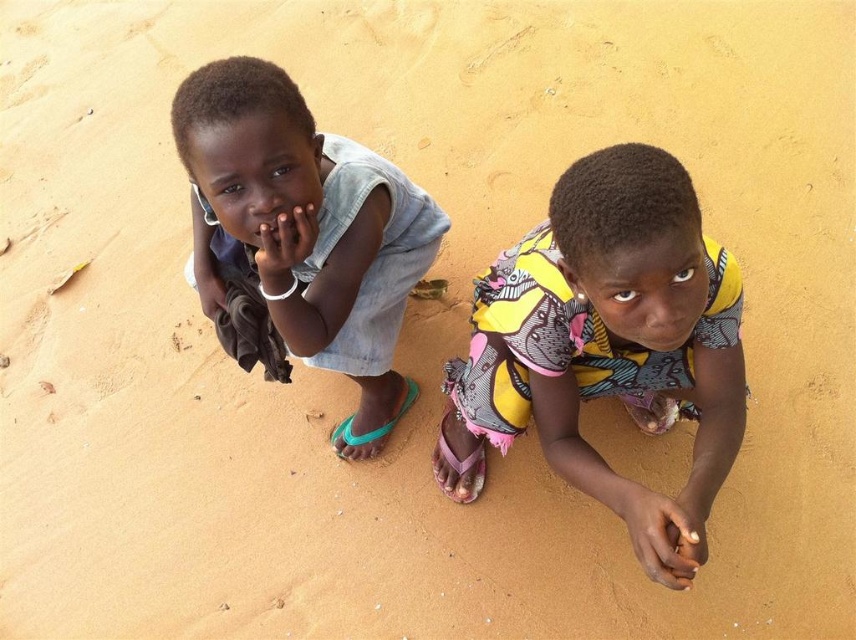
Question: Which point appears closest to the camera in this image?

Choices:
 (A) (736, 448)
 (B) (292, 192)

Answer: (B)

Question: Is printed fabric dress at center to the right of light blue denim shorts at left from the viewer's perspective?

Choices:
 (A) yes
 (B) no

Answer: (A)

Question: Which point is farther to the camera?

Choices:
 (A) light blue denim shorts at left
 (B) printed fabric dress at center

Answer: (A)

Question: Does printed fabric dress at center appear under light blue denim shorts at left?

Choices:
 (A) yes
 (B) no

Answer: (A)

Question: Is printed fabric dress at center positioned behind light blue denim shorts at left?

Choices:
 (A) no
 (B) yes

Answer: (A)